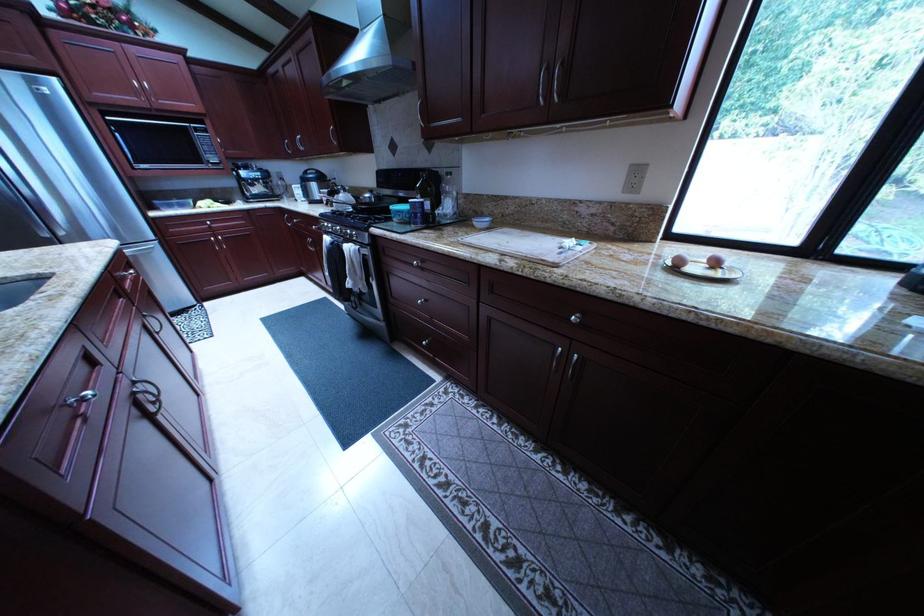
Locate an element on the screen. refrigerator handle is located at coordinates (146, 252).